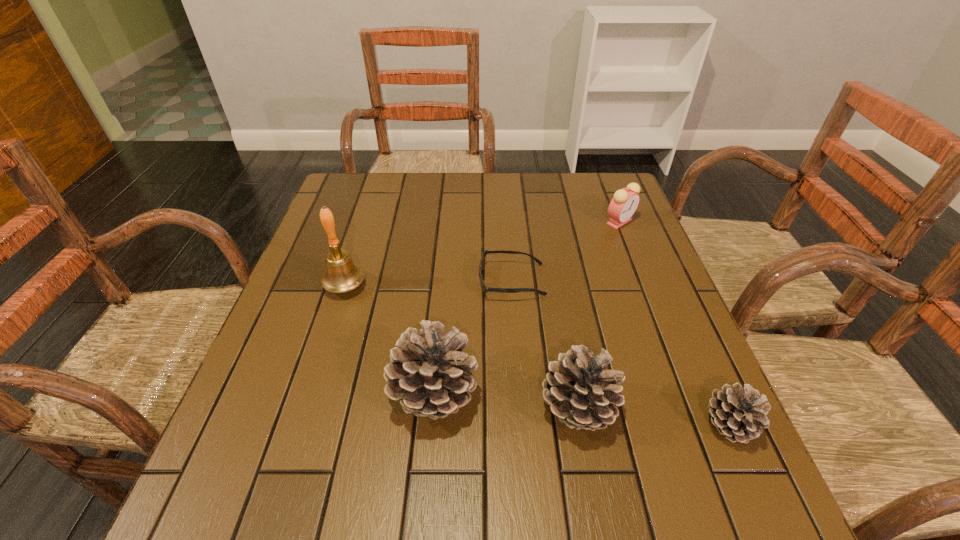
Identify which pinecone is the nearest to the fifth object from right to left. Please provide its 2D coordinates. Your answer should be formatted as a tuple, i.e. [(x, y)], where the tuple contains the x and y coordinates of a point satisfying the conditions above.

[(579, 390)]

Locate an element on the screen. free space that satisfies the following two spatial constraints: 1. on the face of the shortest pinecone; 2. on the left side of the alarm clock is located at coordinates (699, 424).

Locate an element on the screen. The height and width of the screenshot is (540, 960). vacant region that satisfies the following two spatial constraints: 1. on the front-facing side of the shortest object; 2. on the front side of the bell is located at coordinates (512, 286).

Where is `blank area in the image that satisfies the following two spatial constraints: 1. on the front-facing side of the second shortest pinecone; 2. on the left side of the sunglasses`? The width and height of the screenshot is (960, 540). blank area in the image that satisfies the following two spatial constraints: 1. on the front-facing side of the second shortest pinecone; 2. on the left side of the sunglasses is located at coordinates 521,409.

This screenshot has height=540, width=960. Identify the location of free space in the image that satisfies the following two spatial constraints: 1. on the front-facing side of the shortest pinecone; 2. on the right side of the shortest object. (522, 424).

Locate an element on the screen. blank space that satisfies the following two spatial constraints: 1. on the front-facing side of the second shortest pinecone; 2. on the right side of the sunglasses is located at coordinates (521, 409).

Locate an element on the screen. This screenshot has height=540, width=960. free space that satisfies the following two spatial constraints: 1. on the face of the shortest pinecone; 2. on the left side of the alarm clock is located at coordinates (699, 424).

The width and height of the screenshot is (960, 540). In order to click on vacant space that satisfies the following two spatial constraints: 1. on the front side of the rightmost pinecone; 2. on the right side of the leftmost pinecone in this screenshot , I will do `click(431, 424)`.